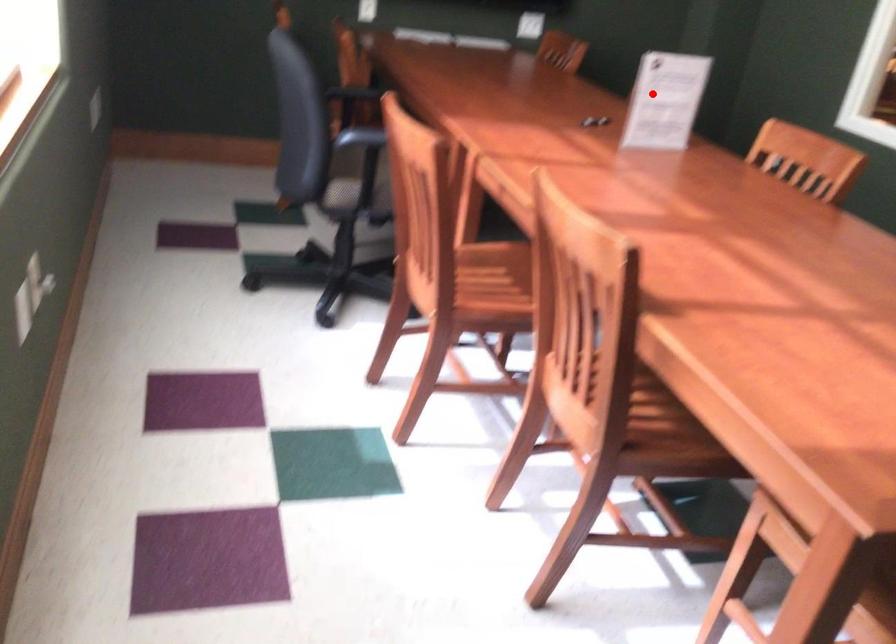
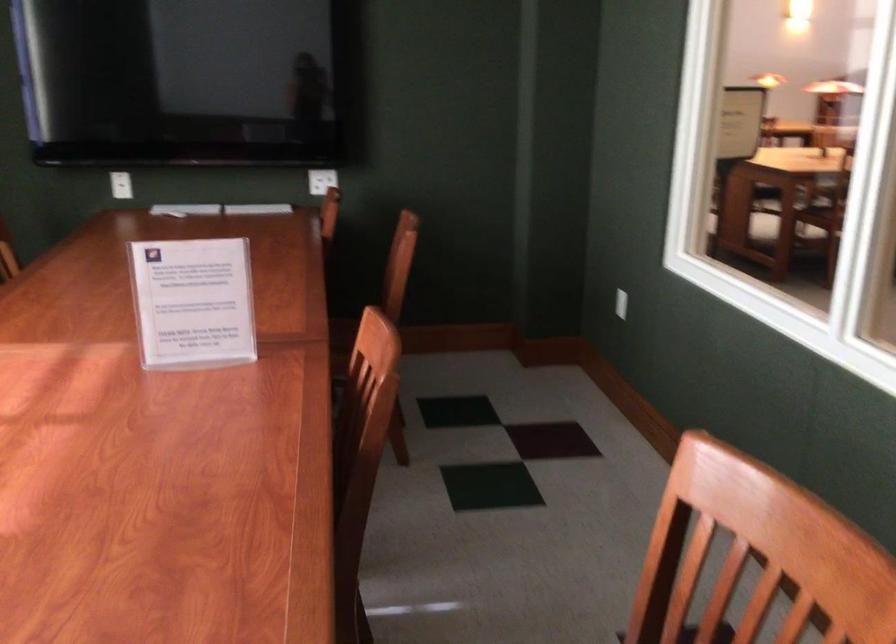
Find the pixel in the second image that matches the highlighted location in the first image.

(193, 303)